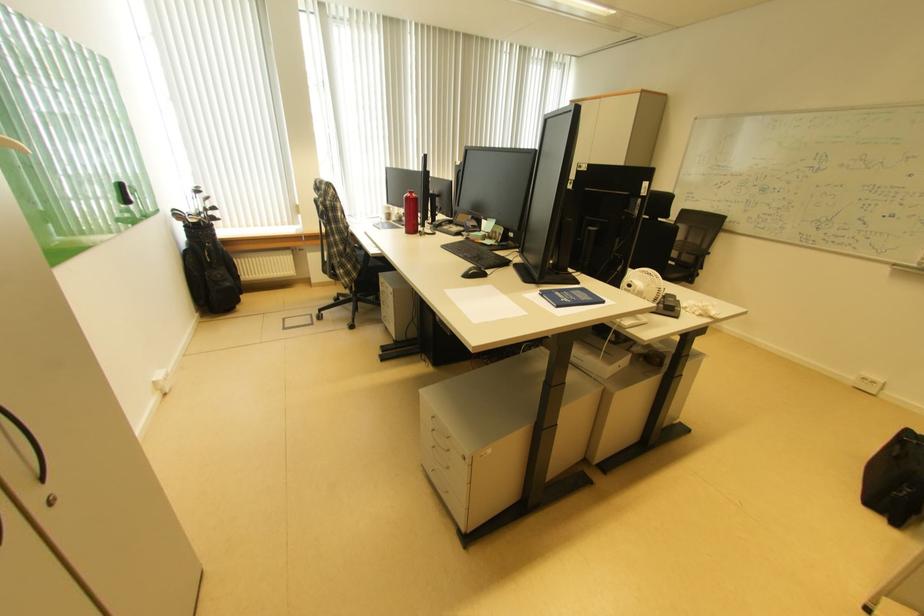
The width and height of the screenshot is (924, 616). In order to click on phone handset in this screenshot , I will do `click(669, 305)`.